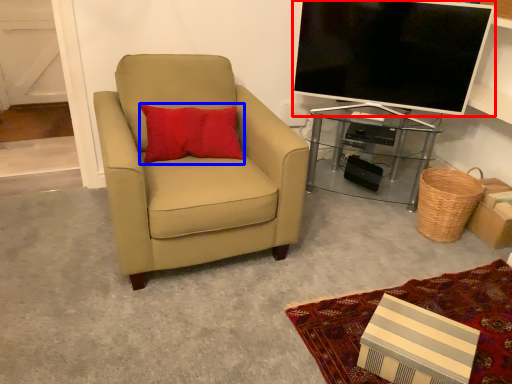
Question: Among these objects, which one is nearest to the camera, television (highlighted by a red box) or pillow (highlighted by a blue box)?

Choices:
 (A) television
 (B) pillow

Answer: (B)